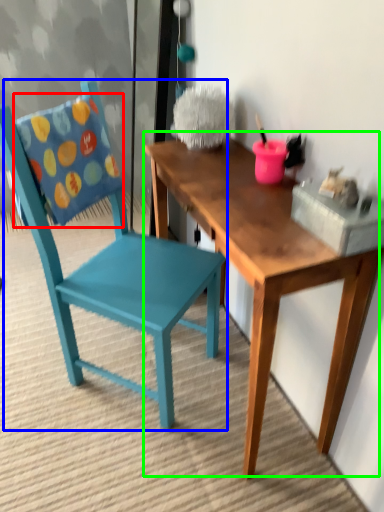
Question: Based on their relative distances, which object is farther from pillow (highlighted by a red box)? Choose from chair (highlighted by a blue box) and table (highlighted by a green box).

Choices:
 (A) chair
 (B) table

Answer: (B)